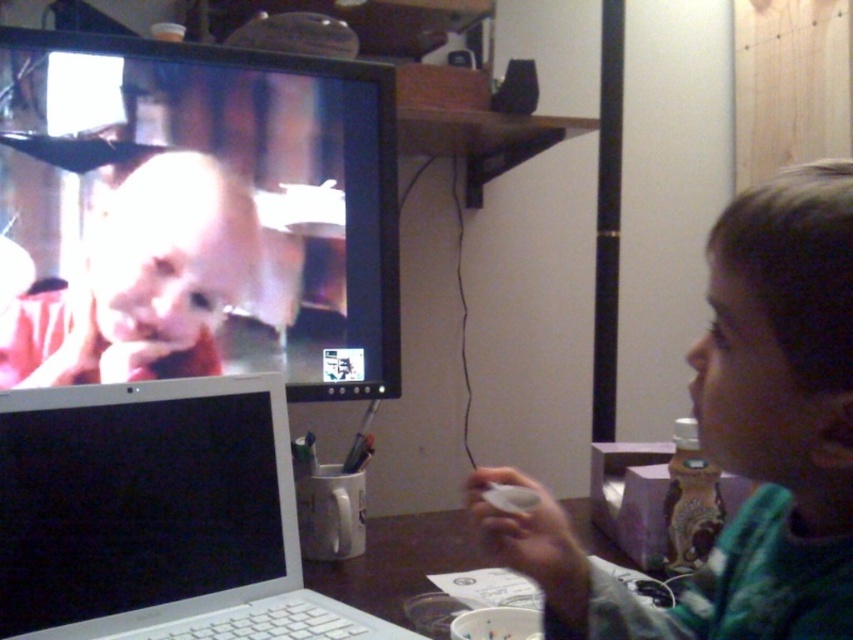
What is the exact coordinate of the matte black monitor at upper left?

The matte black monitor at upper left is located at point (196, 214).

You are organizing a small event and need to place a decorative item on the desk. The desk has limited space. Given the sizes of the green plaid shirt at right and the silver metallic laptop at lower left, which object would you choose to move to make more space?

The green plaid shirt at right is larger in size than the silver metallic laptop at lower left, so moving the green plaid shirt at right would free up more space on the desk.

You are organizing a closet and need to place the green plaid shirt at right. According to the image, where exactly should you position it?

The green plaid shirt at right should be positioned at coordinates point (740, 438) as specified in the description.